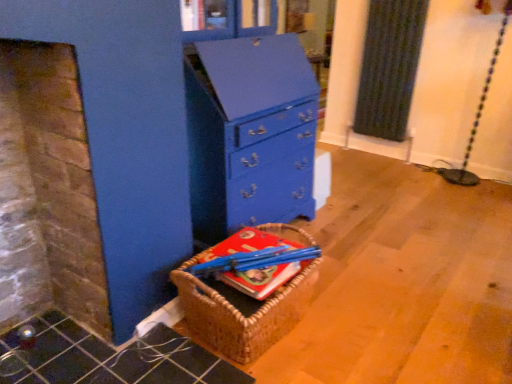
Locate an element on the screen. free location to the right of woven brown basket at lower left is located at coordinates (358, 315).